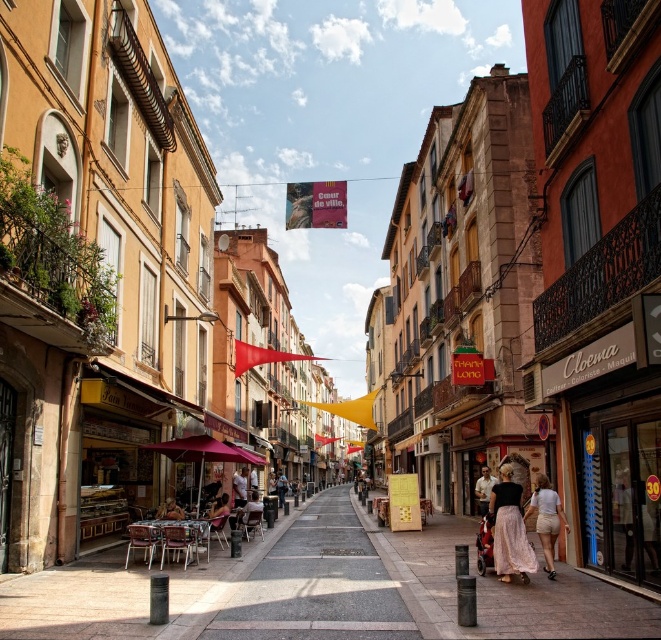
Is light pink fabric skirt at center above pink fabric umbrella at center?

Yes.

Is light pink fabric skirt at center smaller than pink fabric umbrella at center?

Indeed, light pink fabric skirt at center has a smaller size compared to pink fabric umbrella at center.

Which is in front, point (514, 531) or point (163, 449)?

Point (514, 531) is in front.

You are a GUI agent. You are given a task and a screenshot of the screen. Output one action in this format:
    pyautogui.click(x=<x>, y=<y>)
    Task: Click on the light pink fabric skirt at center
    This screenshot has height=640, width=661.
    Given the screenshot: What is the action you would take?
    pyautogui.click(x=510, y=529)

How distant is light pink fabric skirt at center from brown leather jacket at center?

light pink fabric skirt at center is 23.53 meters away from brown leather jacket at center.

Is light pink fabric skirt at center taller than brown leather jacket at center?

Yes, light pink fabric skirt at center is taller than brown leather jacket at center.

Who is more forward, (x=504, y=477) or (x=175, y=500)?

Point (x=504, y=477) is in front.

Locate an element on the screen. The width and height of the screenshot is (661, 640). light pink fabric skirt at center is located at coordinates (510, 529).

Does gray concrete pavement at center appear on the left side of white fabric umbrella at center?

No, gray concrete pavement at center is not to the left of white fabric umbrella at center.

Who is more forward, [371,579] or [243,500]?

Point [371,579]

Does point (360, 579) lie in front of point (241, 486)?

Yes, it is.

Where is `gray concrete pavement at center`? The image size is (661, 640). gray concrete pavement at center is located at coordinates (317, 582).